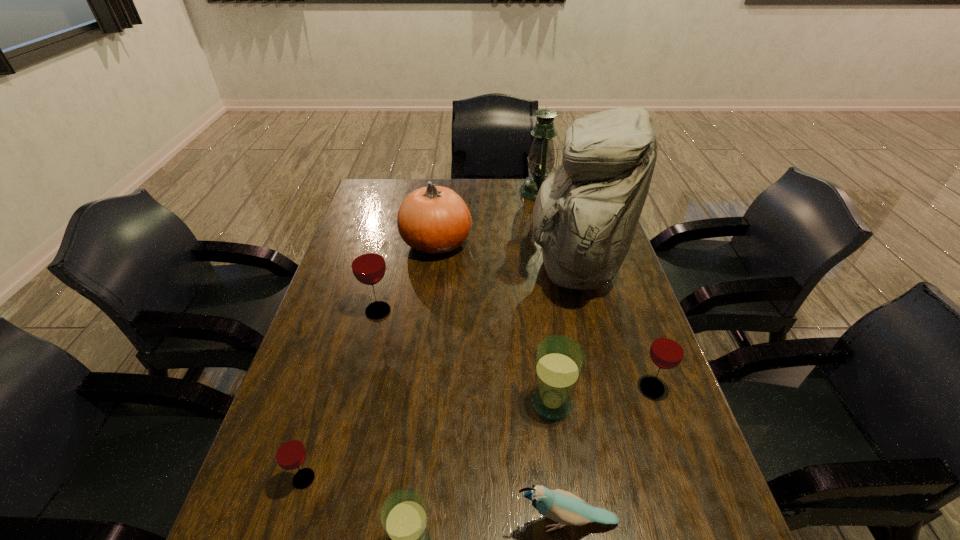
What are the coordinates of `backpack` in the screenshot? It's located at (586, 212).

The width and height of the screenshot is (960, 540). What are the coordinates of `oil lamp` in the screenshot? It's located at (541, 158).

At what (x,y) coordinates should I click in order to perform the action: click on the farthest object. Please return your answer as a coordinate pair (x, y). Image resolution: width=960 pixels, height=540 pixels. Looking at the image, I should click on [541, 158].

Locate an element on the screen. pumpkin is located at coordinates (434, 220).

Locate an element on the screen. the tallest glass is located at coordinates (368, 265).

Find the location of a particular element. The image size is (960, 540). the farthest red glass is located at coordinates (368, 265).

Find the location of `the second biggest red glass`. the second biggest red glass is located at coordinates (667, 350).

What are the coordinates of `the rightmost red glass` in the screenshot? It's located at (667, 350).

Find the location of a particular element. The height and width of the screenshot is (540, 960). the second glass from right to left is located at coordinates (559, 360).

You are a GUI agent. You are given a task and a screenshot of the screen. Output one action in this format:
    pyautogui.click(x=<x>, y=<y>)
    Task: Click on the right blue glass
    
    Given the screenshot: What is the action you would take?
    pyautogui.click(x=559, y=360)